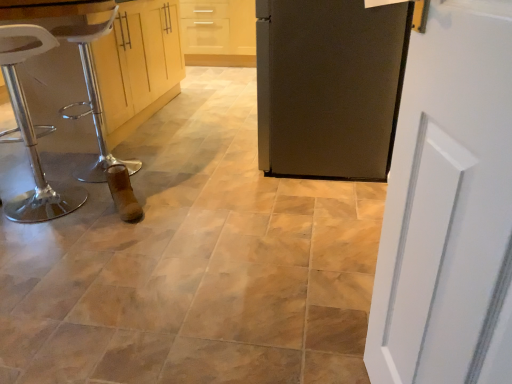
The height and width of the screenshot is (384, 512). I want to click on free area in between matte wood cabinetry at left and matte black refrigerator at center, the second door viewed from the left, so point(203,134).